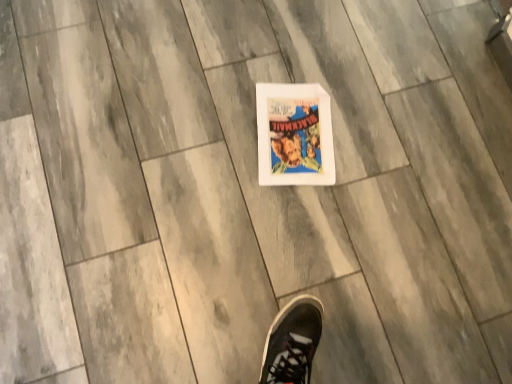
What is the approximate width of matte paper comic book at center?

matte paper comic book at center is 13.89 inches in width.

Find the location of a particular element. The width and height of the screenshot is (512, 384). matte paper comic book at center is located at coordinates point(294,135).

This screenshot has height=384, width=512. What do you see at coordinates (294, 135) in the screenshot?
I see `matte paper comic book at center` at bounding box center [294, 135].

At what (x,y) coordinates should I click in order to perform the action: click on matte paper comic book at center. Please return your answer as a coordinate pair (x, y). This screenshot has width=512, height=384. Looking at the image, I should click on (294, 135).